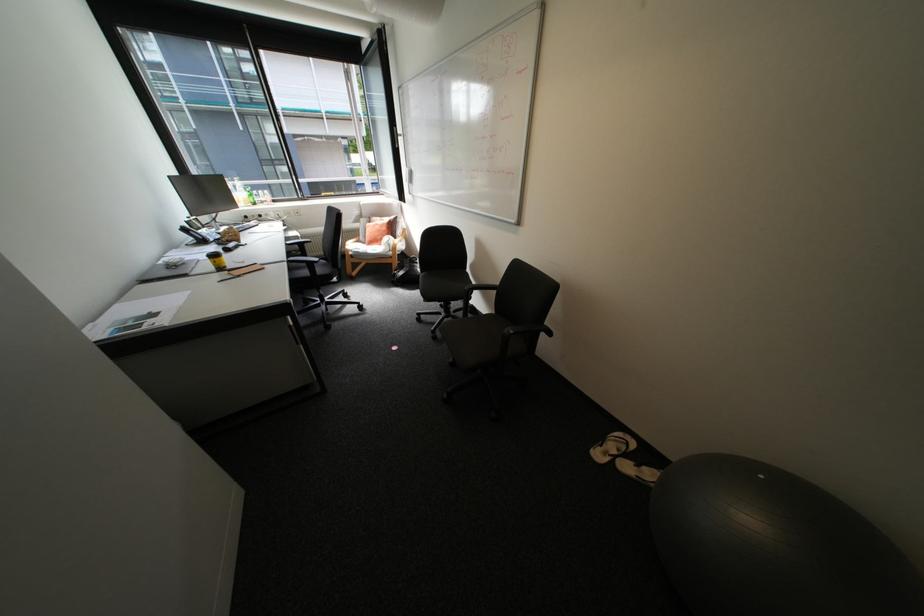
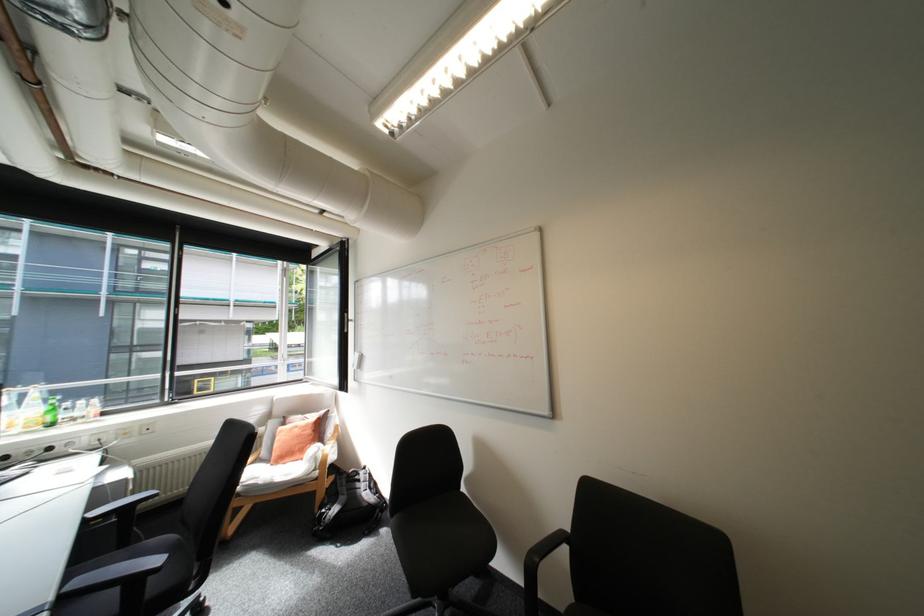
In the second image, find the point that corresponds to (296,244) in the first image.

(94, 519)